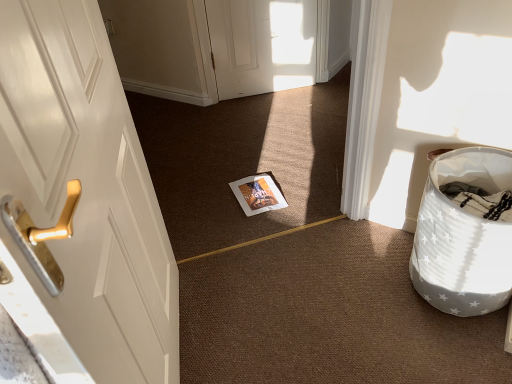
Question: Considering the relative sizes of white star-patterned laundry basket at right and matte paper magazine at center in the image provided, is white star-patterned laundry basket at right taller than matte paper magazine at center?

Choices:
 (A) no
 (B) yes

Answer: (B)

Question: Is white star-patterned laundry basket at right further to camera compared to matte paper magazine at center?

Choices:
 (A) no
 (B) yes

Answer: (A)

Question: Does white star-patterned laundry basket at right have a lesser height compared to matte paper magazine at center?

Choices:
 (A) no
 (B) yes

Answer: (A)

Question: Is white star-patterned laundry basket at right not close to matte paper magazine at center?

Choices:
 (A) yes
 (B) no

Answer: (B)

Question: Is white star-patterned laundry basket at right positioned in front of matte paper magazine at center?

Choices:
 (A) yes
 (B) no

Answer: (A)

Question: Is white star-patterned laundry basket at right positioned with its back to matte paper magazine at center?

Choices:
 (A) no
 (B) yes

Answer: (A)

Question: Is matte paper magazine at center further to the viewer compared to white star-patterned laundry basket at right?

Choices:
 (A) yes
 (B) no

Answer: (A)

Question: Is matte paper magazine at center thinner than white star-patterned laundry basket at right?

Choices:
 (A) yes
 (B) no

Answer: (A)

Question: From the image's perspective, is matte paper magazine at center located beneath white star-patterned laundry basket at right?

Choices:
 (A) no
 (B) yes

Answer: (A)

Question: Is matte paper magazine at center outside of white star-patterned laundry basket at right?

Choices:
 (A) yes
 (B) no

Answer: (A)

Question: Is matte paper magazine at center oriented towards white star-patterned laundry basket at right?

Choices:
 (A) yes
 (B) no

Answer: (B)

Question: Can you confirm if matte paper magazine at center is shorter than white star-patterned laundry basket at right?

Choices:
 (A) no
 (B) yes

Answer: (B)

Question: From the image's perspective, relative to matte paper magazine at center, is white star-patterned laundry basket at right above or below?

Choices:
 (A) below
 (B) above

Answer: (A)